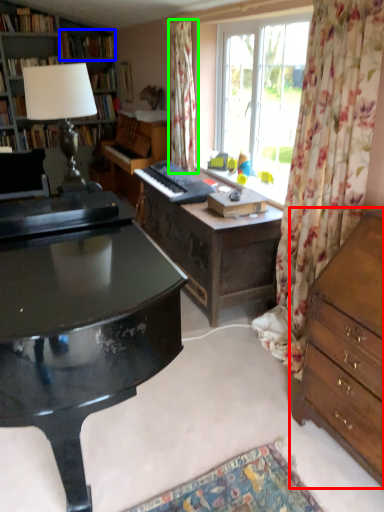
Question: Which object is positioned closest to chest of drawers (highlighted by a red box)? Select from book (highlighted by a blue box) and curtain (highlighted by a green box).

Choices:
 (A) book
 (B) curtain

Answer: (B)